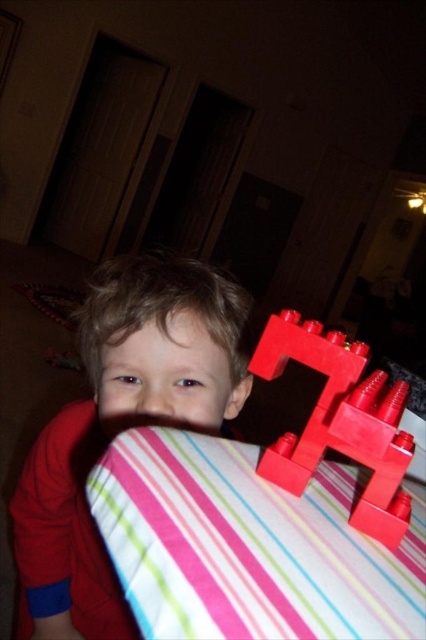
You are a parent trying to store two toys in a vertical storage unit. The matte red toy at center and the matte plastic toy at right need to be placed side by side. Given their height difference, which toy should you place on the lower shelf to ensure stability?

The matte red toy at center is much taller than the matte plastic toy at right. To ensure stability, place the taller matte red toy at center on the lower shelf and the shorter matte plastic toy at right on the upper shelf.

From the picture: You are helping to organize a toy shelf. You have two toys to place on the shelf. The matte red toy at center and the matte plastic toy at right. The shelf has a space that can only accommodate the wider of the two toys. Which toy should you place in that space?

The matte red toy at center should be placed in the space because its width surpasses that of the matte plastic toy at right.

You are a parent trying to organize toys in a childproofed room. You see the matte red toy at center and the matte plastic toy at right. Which toy is closer to the child if the child is sitting in front of the center?

The matte red toy at center is closer to the child since the matte plastic toy at right is positioned behind it.